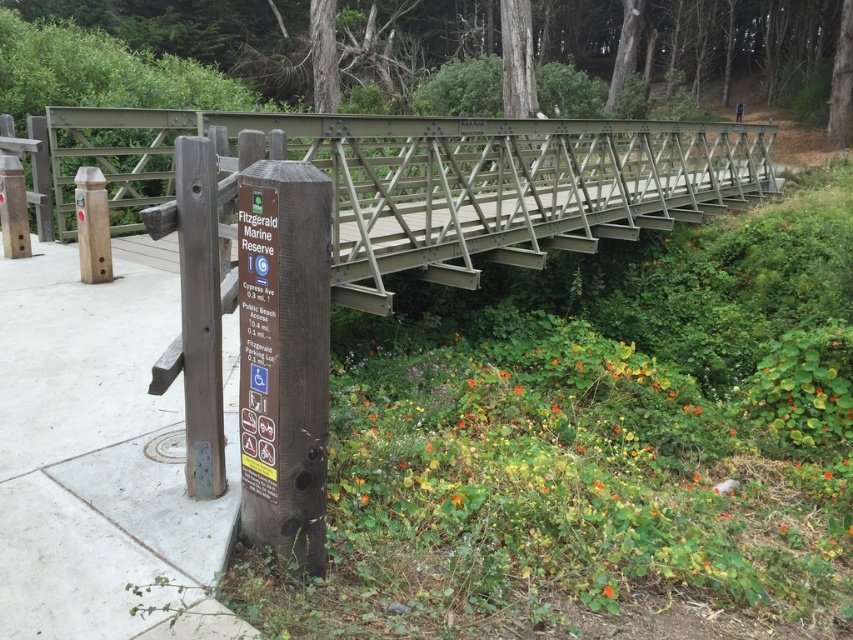
Is white concrete sidewalk at lower left closer to the viewer compared to brown wooden signpost at lower left?

That is True.

Does white concrete sidewalk at lower left appear on the right side of brown wooden signpost at lower left?

Incorrect, white concrete sidewalk at lower left is not on the right side of brown wooden signpost at lower left.

Is point (28, 394) positioned before point (287, 356)?

No, (28, 394) is further to viewer.

The image size is (853, 640). Find the location of `white concrete sidewalk at lower left`. white concrete sidewalk at lower left is located at coordinates (102, 452).

Is metallic gray bridge at upper center shorter than wooden signpost at lower left?

No.

In the scene shown: Does metallic gray bridge at upper center appear over wooden signpost at lower left?

Yes, metallic gray bridge at upper center is above wooden signpost at lower left.

Is point (97, 150) farther from viewer compared to point (276, 266)?

Yes.

Locate an element on the screen. The image size is (853, 640). metallic gray bridge at upper center is located at coordinates (438, 182).

Is white concrete sidewalk at lower left positioned behind wooden signpost at lower left?

No.

Between white concrete sidewalk at lower left and wooden signpost at lower left, which one appears on the right side from the viewer's perspective?

wooden signpost at lower left

Is point (3, 310) positioned before point (256, 202)?

No, (3, 310) is behind (256, 202).

This screenshot has height=640, width=853. What are the coordinates of `white concrete sidewalk at lower left` in the screenshot? It's located at (102, 452).